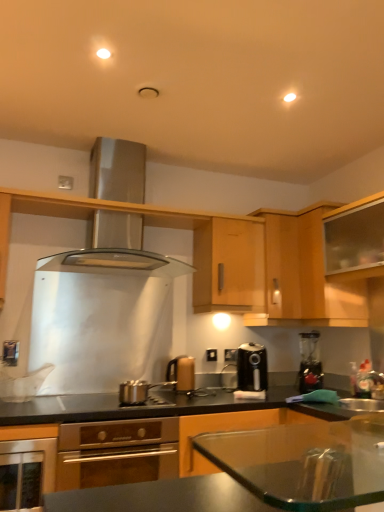
In order to click on black plastic blender at right in this screenshot , I will do `click(310, 362)`.

What do you see at coordinates (26, 473) in the screenshot? I see `stainless steel oven at lower left` at bounding box center [26, 473].

Looking at this image, what is the approximate height of transparent plastic sink at right?

7.65 inches.

Looking at this image, measure the distance between black plastic air fryer at center, positioned as the 4th kitchen appliance in left-to-right order, and camera.

black plastic air fryer at center, positioned as the 4th kitchen appliance in left-to-right order, is 2.64 meters away from camera.

Image resolution: width=384 pixels, height=512 pixels. Identify the location of black plastic air fryer at center, positioned as the 4th kitchen appliance in left-to-right order. (252, 368).

You are a GUI agent. You are given a task and a screenshot of the screen. Output one action in this format:
    pyautogui.click(x=<x>, y=<y>)
    Task: Click on the light wood cabinet at upper right, which is counted as the third cabinetry, starting from the left
    The image size is (384, 512).
    Given the screenshot: What is the action you would take?
    pyautogui.click(x=304, y=275)

What are the coordinates of `satin silver oven at lower center, which is the fourth kitchen appliance in right-to-left order` in the screenshot? It's located at (116, 452).

Is black plastic blender at right positioned with its back to satin silver exhaust hood at upper center?

No, satin silver exhaust hood at upper center is not at the back of black plastic blender at right.

From a real-world perspective, is black plastic blender at right physically above satin silver exhaust hood at upper center?

Actually, black plastic blender at right is physically below satin silver exhaust hood at upper center in the real world.

You are a GUI agent. You are given a task and a screenshot of the screen. Output one action in this format:
    pyautogui.click(x=<x>, y=<y>)
    Task: Click on the appliance directly beneath the satin silver exhaust hood at upper center (from a real-world perspective)
    The image size is (384, 512).
    Given the screenshot: What is the action you would take?
    pyautogui.click(x=310, y=362)

Who is shorter, black plastic blender at right or satin silver exhaust hood at upper center?

black plastic blender at right.

Is stainless steel oven at lower left surrounded by matte gold kettle at center, which ranks as the second kitchen appliance in right-to-left order?

No, stainless steel oven at lower left is located outside of matte gold kettle at center, which ranks as the second kitchen appliance in right-to-left order.

Based on the photo, is matte gold kettle at center, the 3th kitchen appliance viewed from the left, in contact with stainless steel oven at lower left?

matte gold kettle at center, the 3th kitchen appliance viewed from the left, is not next to stainless steel oven at lower left, and they're not touching.

Which is in front, matte gold kettle at center, which ranks as the second kitchen appliance in right-to-left order, or stainless steel oven at lower left?

stainless steel oven at lower left is closer to the camera.

Considering the relative sizes of matte gold kettle at center, which ranks as the second kitchen appliance in right-to-left order, and stainless steel oven at lower left in the image provided, is matte gold kettle at center, which ranks as the second kitchen appliance in right-to-left order, wider than stainless steel oven at lower left?

No, matte gold kettle at center, which ranks as the second kitchen appliance in right-to-left order, is not wider than stainless steel oven at lower left.

Visually, is black plastic air fryer at center, marked as the first kitchen appliance in a right-to-left arrangement, positioned to the left or to the right of transparent plastic sink at right?

From the image, it's evident that black plastic air fryer at center, marked as the first kitchen appliance in a right-to-left arrangement, is to the left of transparent plastic sink at right.

Who is smaller, black plastic air fryer at center, marked as the first kitchen appliance in a right-to-left arrangement, or transparent plastic sink at right?

transparent plastic sink at right.

Which kitchen appliance is the 1st one when counting from the back of the transparent plastic sink at right? Please provide its 2D coordinates.

[(252, 368)]

From the image's perspective, which one is positioned higher, black plastic air fryer at center, positioned as the 4th kitchen appliance in left-to-right order, or transparent plastic sink at right?

black plastic air fryer at center, positioned as the 4th kitchen appliance in left-to-right order, is shown above in the image.

Are light wood cabinet at center, the fourth cabinetry viewed from the right, and black glossy countertop at center far apart?

light wood cabinet at center, the fourth cabinetry viewed from the right, is near black glossy countertop at center, not far away.

Considering the sizes of objects light wood cabinet at center, the fourth cabinetry viewed from the right, and black glossy countertop at center in the image provided, who is smaller, light wood cabinet at center, the fourth cabinetry viewed from the right, or black glossy countertop at center?

light wood cabinet at center, the fourth cabinetry viewed from the right.

The image size is (384, 512). In order to click on countertop lying below the light wood cabinet at center, arranged as the first cabinetry when viewed from the left (from the image's perspective) in this screenshot , I will do `click(159, 406)`.

Between light wood cabinet at center, arranged as the first cabinetry when viewed from the left, and black glossy countertop at center, which one appears on the right side from the viewer's perspective?

From the viewer's perspective, light wood cabinet at center, arranged as the first cabinetry when viewed from the left, appears more on the right side.

In the image, is satin silver exhaust hood at upper center positioned in front of or behind light wood cabinet at upper right, placed as the 2th cabinetry when sorted from right to left?

satin silver exhaust hood at upper center is in front of light wood cabinet at upper right, placed as the 2th cabinetry when sorted from right to left.

Considering the positions of points (176, 269) and (342, 314), is point (176, 269) farther from camera compared to point (342, 314)?

Yes, it is.

Where is `the 1st cabinetry behind when counting from the satin silver exhaust hood at upper center`? Image resolution: width=384 pixels, height=512 pixels. the 1st cabinetry behind when counting from the satin silver exhaust hood at upper center is located at coordinates (304, 275).

Is there a large distance between satin silver exhaust hood at upper center and light wood cabinet at upper right, placed as the 2th cabinetry when sorted from right to left?

That's not correct — satin silver exhaust hood at upper center is a little close to light wood cabinet at upper right, placed as the 2th cabinetry when sorted from right to left.

Based on the photo, is stainless steel oven at lower left in front of or behind transparent glass cabinet at upper right, positioned as the first cabinetry in right-to-left order, in the image?

Clearly, stainless steel oven at lower left is in front of transparent glass cabinet at upper right, positioned as the first cabinetry in right-to-left order.

From the picture: Is stainless steel oven at lower left taller than transparent glass cabinet at upper right, marked as the fourth cabinetry in a left-to-right arrangement?

No.

Between stainless steel oven at lower left and transparent glass cabinet at upper right, marked as the fourth cabinetry in a left-to-right arrangement, which one appears on the right side from the viewer's perspective?

Positioned to the right is transparent glass cabinet at upper right, marked as the fourth cabinetry in a left-to-right arrangement.

Which of these two, satin silver exhaust hood at upper center or black plastic blender at right, is bigger?

With larger size is satin silver exhaust hood at upper center.

Consider the image. Measure the distance from satin silver exhaust hood at upper center to black plastic blender at right.

satin silver exhaust hood at upper center and black plastic blender at right are 1.61 meters apart from each other.

Can you confirm if satin silver exhaust hood at upper center is shorter than black plastic blender at right?

No.

I want to click on exhaust hood to the left of black plastic blender at right, so point(117,249).

You are a GUI agent. You are given a task and a screenshot of the screen. Output one action in this format:
    pyautogui.click(x=<x>, y=<y>)
    Task: Click on the 3rd kitchen appliance to the right of the stainless steel oven at lower left, counting from the anchor's position
    This screenshot has height=512, width=384.
    Given the screenshot: What is the action you would take?
    tap(182, 373)

Based on their spatial positions, is satin silver exhaust hood at upper center or transparent plastic sink at right further from light wood cabinet at center, the fourth cabinetry viewed from the right?

transparent plastic sink at right is positioned further to the anchor light wood cabinet at center, the fourth cabinetry viewed from the right.

From the image, which object appears to be nearer to black plastic blender at right, matte gold kettle at center, the 3th kitchen appliance viewed from the left, or transparent plastic sink at right?

Based on the image, transparent plastic sink at right appears to be nearer to black plastic blender at right.

Which object lies further to the anchor point light wood cabinet at upper right, placed as the 2th cabinetry when sorted from right to left, transparent glass cabinet at upper right, positioned as the first cabinetry in right-to-left order, or black glossy countertop at center?

black glossy countertop at center is positioned further to the anchor light wood cabinet at upper right, placed as the 2th cabinetry when sorted from right to left.

When comparing their distances from stainless steel oven at lower left, does black plastic air fryer at center, marked as the first kitchen appliance in a right-to-left arrangement, or black glossy countertop at center seem closer?

The object closer to stainless steel oven at lower left is black glossy countertop at center.

Looking at the image, which one is located closer to transparent glass cabinet at upper right, marked as the fourth cabinetry in a left-to-right arrangement, wooden cabinet at center, which is the 3th cabinetry in right-to-left order, or black plastic blender at right?

wooden cabinet at center, which is the 3th cabinetry in right-to-left order.

Based on their spatial positions, is light wood cabinet at upper right, which is counted as the third cabinetry, starting from the left, or transparent plastic sink at right closer to black glossy countertop at center?

transparent plastic sink at right is positioned closer to the anchor black glossy countertop at center.

From the image, which object appears to be farther from satin silver exhaust hood at upper center, satin silver oven at lower center, which is the fourth kitchen appliance in right-to-left order, or black plastic blender at right?

Based on the image, black plastic blender at right appears to be further to satin silver exhaust hood at upper center.

From the image, which object appears to be nearer to light wood cabinet at center, the fourth cabinetry viewed from the right, transparent glass cabinet at upper right, marked as the fourth cabinetry in a left-to-right arrangement, or stainless steel oven at lower left?

transparent glass cabinet at upper right, marked as the fourth cabinetry in a left-to-right arrangement, is positioned closer to the anchor light wood cabinet at center, the fourth cabinetry viewed from the right.

Locate an element on the screen. appliance between light wood cabinet at center, the fourth cabinetry viewed from the right, and black plastic air fryer at center, marked as the first kitchen appliance in a right-to-left arrangement, in the vertical direction is located at coordinates (310, 362).

Image resolution: width=384 pixels, height=512 pixels. Find the location of `countertop between stainless steel oven at lower left and transparent plastic sink at right from left to right`. countertop between stainless steel oven at lower left and transparent plastic sink at right from left to right is located at coordinates (159, 406).

Find the location of `appliance between wooden cabinet at center, the second cabinetry in the left-to-right sequence, and transparent plastic sink at right vertically`. appliance between wooden cabinet at center, the second cabinetry in the left-to-right sequence, and transparent plastic sink at right vertically is located at coordinates (310, 362).

Where is `appliance between light wood cabinet at upper right, placed as the 2th cabinetry when sorted from right to left, and black plastic air fryer at center, marked as the first kitchen appliance in a right-to-left arrangement, from top to bottom`? appliance between light wood cabinet at upper right, placed as the 2th cabinetry when sorted from right to left, and black plastic air fryer at center, marked as the first kitchen appliance in a right-to-left arrangement, from top to bottom is located at coordinates pos(310,362).